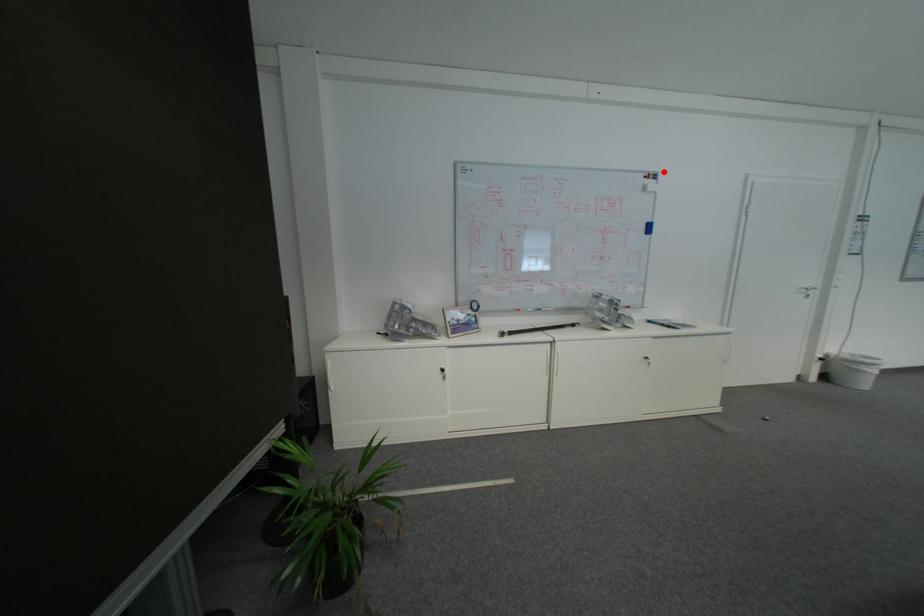
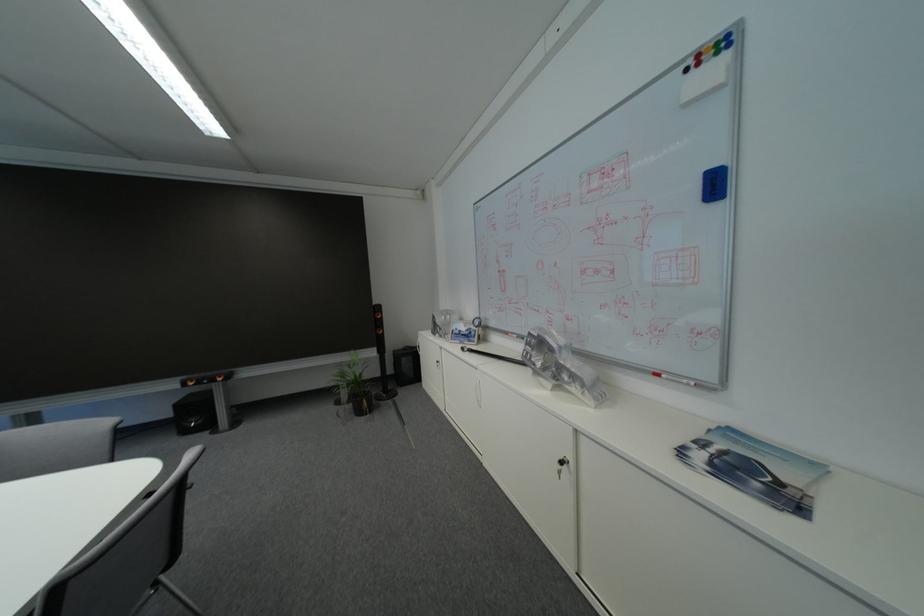
Locate, in the second image, the point that corresponds to the highlighted location in the first image.

(723, 34)